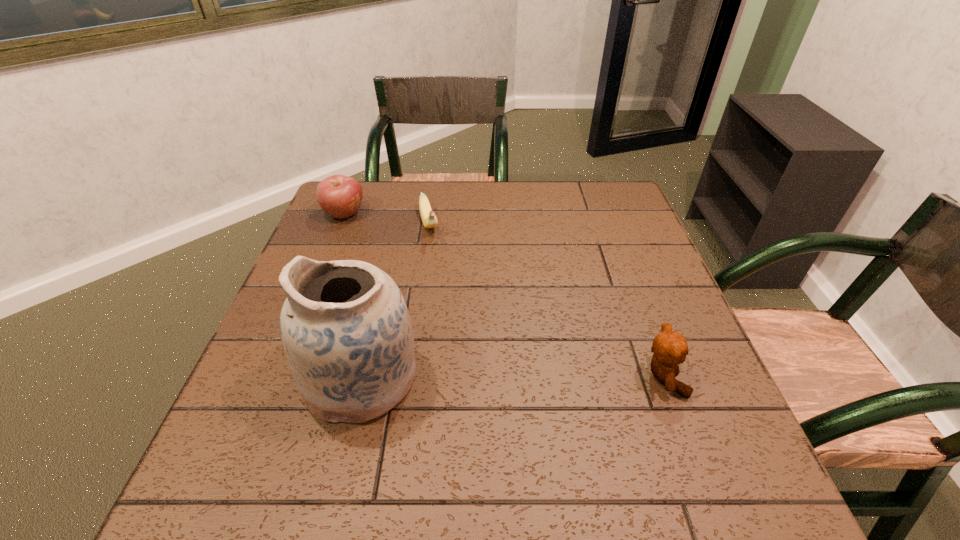
Where is `the tallest object`? This screenshot has height=540, width=960. the tallest object is located at coordinates (345, 327).

Find the location of a particular element. The height and width of the screenshot is (540, 960). teddy bear is located at coordinates (670, 348).

This screenshot has height=540, width=960. I want to click on the rightmost object, so click(x=670, y=348).

You are a GUI agent. You are given a task and a screenshot of the screen. Output one action in this format:
    pyautogui.click(x=<x>, y=<y>)
    Task: Click on the banana
    
    Given the screenshot: What is the action you would take?
    pyautogui.click(x=429, y=219)

The height and width of the screenshot is (540, 960). Find the location of `apple`. apple is located at coordinates (340, 196).

This screenshot has height=540, width=960. I want to click on vacant area situated 0.300m on the right of the tallest object, so click(x=571, y=377).

You are a GUI agent. You are given a task and a screenshot of the screen. Output one action in this format:
    pyautogui.click(x=<x>, y=<y>)
    Task: Click on the blank space located 0.080m at the stem of the banana
    
    Given the screenshot: What is the action you would take?
    pyautogui.click(x=435, y=262)

Locate an element on the screen. free space located 0.170m at the stem of the banana is located at coordinates (442, 286).

The image size is (960, 540). I want to click on vacant space located 0.200m at the stem of the banana, so [444, 294].

Identify the location of free space located on the side of the apple with the unique marking. This screenshot has height=540, width=960. (411, 278).